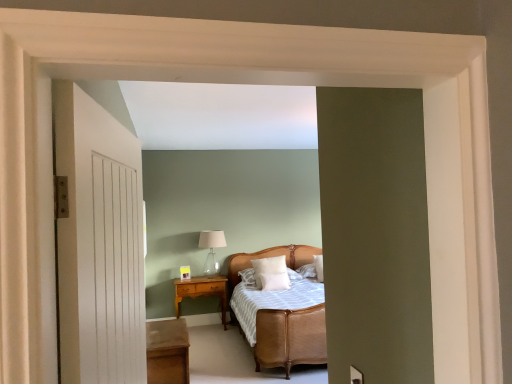
What do you see at coordinates (99, 244) in the screenshot?
I see `white wooden door at left` at bounding box center [99, 244].

This screenshot has height=384, width=512. I want to click on wooden nightstand at center, so click(x=202, y=291).

Describe the element at coordinates (271, 273) in the screenshot. I see `white soft pillow at center, the 3th pillow in the right-to-left sequence` at that location.

What is the approximate width of wooden table at lower left?

The width of wooden table at lower left is 46.69 centimeters.

Image resolution: width=512 pixels, height=384 pixels. I want to click on white soft pillow at upper right, arranged as the first pillow when viewed from the right, so click(x=319, y=267).

In order to face rattan bed at center, should I rotate leftwards or rightwards?

Rotate right and turn 5.921 degrees.

This screenshot has height=384, width=512. In order to click on white wooden door at left in this screenshot , I will do `click(99, 244)`.

From a real-world perspective, is white soft pillow at upper right, arranged as the first pillow when viewed from the right, beneath wooden nightstand at center?

No, from a real-world perspective, white soft pillow at upper right, arranged as the first pillow when viewed from the right, is not under wooden nightstand at center.

Could you tell me if white soft pillow at upper right, arranged as the first pillow when viewed from the right, is turned towards wooden nightstand at center?

No.

From the image's perspective, which is above, white soft pillow at upper right, which is the third pillow from left to right, or wooden nightstand at center?

white soft pillow at upper right, which is the third pillow from left to right, is shown above in the image.

From a real-world perspective, is rattan bed at center physically located above or below white soft pillow at center, which is the 2th pillow in left-to-right order?

Clearly, from a real-world perspective, rattan bed at center is below white soft pillow at center, which is the 2th pillow in left-to-right order.

Where is `the 1st pillow behind the rattan bed at center`? This screenshot has height=384, width=512. the 1st pillow behind the rattan bed at center is located at coordinates (274, 281).

Considering the points (275, 328) and (259, 275), which point is in front, point (275, 328) or point (259, 275)?

The point (275, 328) is more forward.

Is rattan bed at center positioned behind white soft pillow at center, which is the 2th pillow in left-to-right order?

No, the depth of rattan bed at center is less than that of white soft pillow at center, which is the 2th pillow in left-to-right order.

Is clear glass table lamp at center in front of or behind white soft pillow at center, which is the 2th pillow in left-to-right order, in the image?

clear glass table lamp at center is positioned farther from the viewer than white soft pillow at center, which is the 2th pillow in left-to-right order.

Considering the sizes of objects clear glass table lamp at center and white soft pillow at center, which is the 2th pillow in left-to-right order, in the image provided, who is shorter, clear glass table lamp at center or white soft pillow at center, which is the 2th pillow in left-to-right order,?

Standing shorter between the two is white soft pillow at center, which is the 2th pillow in left-to-right order.

Is white soft pillow at center, acting as the 2th pillow starting from the right, inside clear glass table lamp at center?

No, white soft pillow at center, acting as the 2th pillow starting from the right, is located outside of clear glass table lamp at center.

Is clear glass table lamp at center next to white soft pillow at center, which is the 2th pillow in left-to-right order?

There is a gap between clear glass table lamp at center and white soft pillow at center, which is the 2th pillow in left-to-right order.

Is point (72, 313) more distant than point (278, 258)?

No, (72, 313) is in front of (278, 258).

Is white wooden door at left turned away from white soft pillow at center, the 3th pillow in the right-to-left sequence?

No, white soft pillow at center, the 3th pillow in the right-to-left sequence, is not at the back of white wooden door at left.

Is white wooden door at left positioned far away from white soft pillow at center, the 3th pillow in the right-to-left sequence?

white wooden door at left is far away from white soft pillow at center, the 3th pillow in the right-to-left sequence.

From the picture: Is white wooden door at left located outside white soft pillow at center, positioned as the first pillow in left-to-right order?

Yes, white wooden door at left is located beyond the bounds of white soft pillow at center, positioned as the first pillow in left-to-right order.

From a real-world perspective, relative to white soft pillow at center, acting as the 2th pillow starting from the right, is white wooden door at left vertically above or below?

From a real-world perspective, white wooden door at left is physically above white soft pillow at center, acting as the 2th pillow starting from the right.

Is white wooden door at left behind white soft pillow at center, which is the 2th pillow in left-to-right order?

No, the depth of white wooden door at left is less than that of white soft pillow at center, which is the 2th pillow in left-to-right order.

Is white wooden door at left aimed at white soft pillow at center, which is the 2th pillow in left-to-right order?

No.

Consider the image. Considering the relative sizes of white wooden door at left and white soft pillow at center, acting as the 2th pillow starting from the right, in the image provided, is white wooden door at left bigger than white soft pillow at center, acting as the 2th pillow starting from the right,?

Yes.

Considering the relative sizes of white soft pillow at center, which is the 2th pillow in left-to-right order, and white soft pillow at upper right, arranged as the first pillow when viewed from the right, in the image provided, is white soft pillow at center, which is the 2th pillow in left-to-right order, bigger than white soft pillow at upper right, arranged as the first pillow when viewed from the right,?

Actually, white soft pillow at center, which is the 2th pillow in left-to-right order, might be smaller than white soft pillow at upper right, arranged as the first pillow when viewed from the right.

Considering the positions of objects white soft pillow at center, acting as the 2th pillow starting from the right, and white soft pillow at upper right, arranged as the first pillow when viewed from the right, in the image provided, who is behind, white soft pillow at center, acting as the 2th pillow starting from the right, or white soft pillow at upper right, arranged as the first pillow when viewed from the right,?

white soft pillow at upper right, arranged as the first pillow when viewed from the right, is more distant.

Is white soft pillow at center, acting as the 2th pillow starting from the right, positioned beyond the bounds of white soft pillow at upper right, arranged as the first pillow when viewed from the right?

Indeed, white soft pillow at center, acting as the 2th pillow starting from the right, is completely outside white soft pillow at upper right, arranged as the first pillow when viewed from the right.

Where is `pillow that is the 2nd object located below the white soft pillow at upper right, which is the third pillow from left to right (from the image's perspective)`? pillow that is the 2nd object located below the white soft pillow at upper right, which is the third pillow from left to right (from the image's perspective) is located at coordinates (274, 281).

From a real-world perspective, is wooden nightstand at center under white soft pillow at upper right, arranged as the first pillow when viewed from the right?

Yes, from a real-world perspective, wooden nightstand at center is below white soft pillow at upper right, arranged as the first pillow when viewed from the right.

Who is taller, wooden nightstand at center or white soft pillow at upper right, which is the third pillow from left to right?

wooden nightstand at center is taller.

Is wooden nightstand at center in contact with white soft pillow at upper right, which is the third pillow from left to right?

No, wooden nightstand at center is not in contact with white soft pillow at upper right, which is the third pillow from left to right.

The width and height of the screenshot is (512, 384). Find the location of `nightstand below the white soft pillow at upper right, which is the third pillow from left to right (from a real-world perspective)`. nightstand below the white soft pillow at upper right, which is the third pillow from left to right (from a real-world perspective) is located at coordinates (202, 291).

The height and width of the screenshot is (384, 512). In order to click on nightstand in front of the white soft pillow at upper right, arranged as the first pillow when viewed from the right in this screenshot , I will do `click(202, 291)`.

Where is `bed that appears on the right of white soft pillow at center, acting as the 2th pillow starting from the right`? bed that appears on the right of white soft pillow at center, acting as the 2th pillow starting from the right is located at coordinates (290, 338).

Considering their positions, is white soft pillow at center, which is the 2th pillow in left-to-right order, positioned closer to white soft pillow at upper right, which is the third pillow from left to right, than rattan bed at center?

white soft pillow at center, which is the 2th pillow in left-to-right order.

Based on their spatial positions, is white soft pillow at center, the 3th pillow in the right-to-left sequence, or white wooden door at left closer to wooden table at lower left?

Among the two, white soft pillow at center, the 3th pillow in the right-to-left sequence, is located nearer to wooden table at lower left.

Based on their spatial positions, is white wooden door at left or clear glass table lamp at center closer to white soft pillow at center, acting as the 2th pillow starting from the right?

clear glass table lamp at center is closer to white soft pillow at center, acting as the 2th pillow starting from the right.

From the image, which object appears to be nearer to white soft pillow at center, which is the 2th pillow in left-to-right order, rattan bed at center or white wooden door at left?

rattan bed at center.

Looking at the image, which one is located closer to rattan bed at center, white wooden door at left or white soft pillow at center, positioned as the first pillow in left-to-right order?

white soft pillow at center, positioned as the first pillow in left-to-right order, is positioned closer to the anchor rattan bed at center.

Which object lies nearer to the anchor point white wooden door at left, white soft pillow at center, acting as the 2th pillow starting from the right, or white soft pillow at center, positioned as the first pillow in left-to-right order?

The object closer to white wooden door at left is white soft pillow at center, acting as the 2th pillow starting from the right.

Looking at the image, which one is located closer to rattan bed at center, white soft pillow at center, the 3th pillow in the right-to-left sequence, or wooden table at lower left?

wooden table at lower left.

When comparing their distances from white soft pillow at center, positioned as the first pillow in left-to-right order, does rattan bed at center or wooden nightstand at center seem further?

rattan bed at center is positioned further to the anchor white soft pillow at center, positioned as the first pillow in left-to-right order.

The width and height of the screenshot is (512, 384). What are the coordinates of `table located between white wooden door at left and clear glass table lamp at center in the depth direction` in the screenshot? It's located at (167, 352).

This screenshot has width=512, height=384. I want to click on nightstand between wooden table at lower left and white soft pillow at center, the 3th pillow in the right-to-left sequence, from front to back, so click(x=202, y=291).

Where is `pillow between clear glass table lamp at center and white soft pillow at center, acting as the 2th pillow starting from the right, from left to right`? This screenshot has width=512, height=384. pillow between clear glass table lamp at center and white soft pillow at center, acting as the 2th pillow starting from the right, from left to right is located at coordinates point(271,273).

The width and height of the screenshot is (512, 384). I want to click on bed located between white wooden door at left and white soft pillow at center, which is the 2th pillow in left-to-right order, in the depth direction, so click(x=290, y=338).